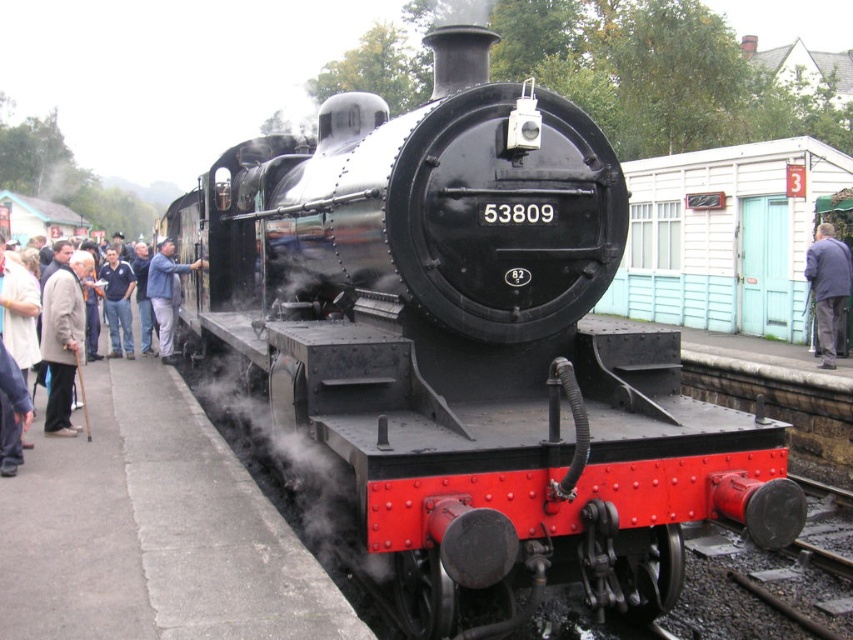
You are a photographer standing at the back of the vintage steam locomotive number 53809. You want to take a photo of the light brown leather jacket at left and the blue fabric coat at right. Which object is closer to the front of the locomotive?

The light brown leather jacket at left is positioned under the blue fabric coat at right, meaning it is closer to the front of the locomotive.

In the scene shown: You are a tailor observing two coats on a rack at the train station. The coats are the light beige coat at left and the blue fabric coat at right. Which coat would require less fabric to make a similar one?

The light beige coat at left requires less fabric to make a similar one since it is thinner than the blue fabric coat at right.